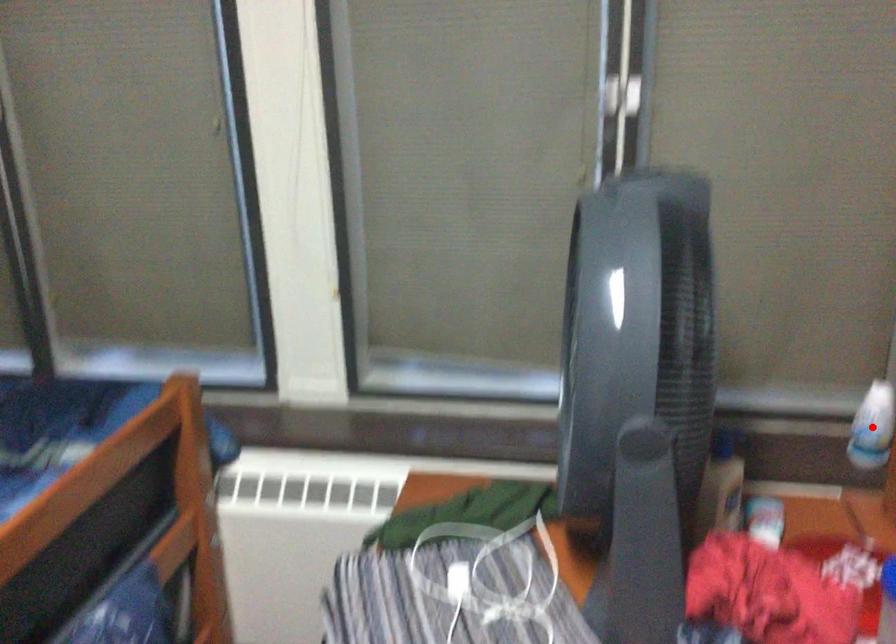
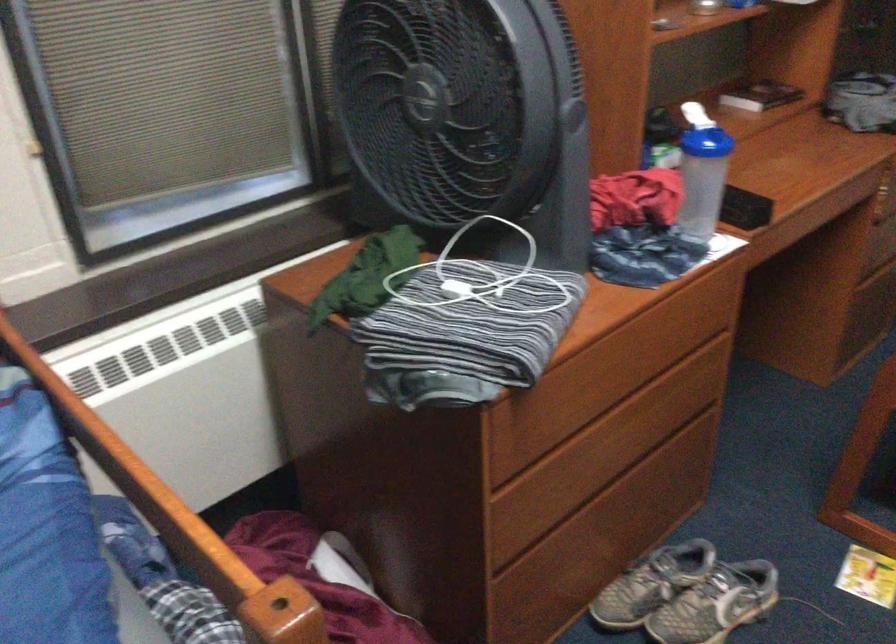
Question: I am providing you with two images of the same scene from different viewpoints. A red point is marked on the first image. At the location where the point appears in image 1, is it still visible in image 2?

Choices:
 (A) Yes
 (B) No

Answer: (B)